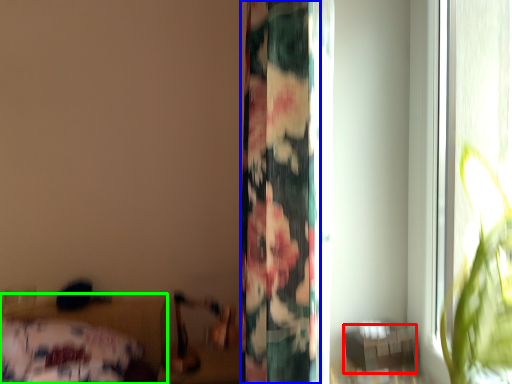
Question: Considering the real-world distances, which object is farthest from table (highlighted by a red box)? curtain (highlighted by a blue box) or bed (highlighted by a green box)?

Choices:
 (A) curtain
 (B) bed

Answer: (B)